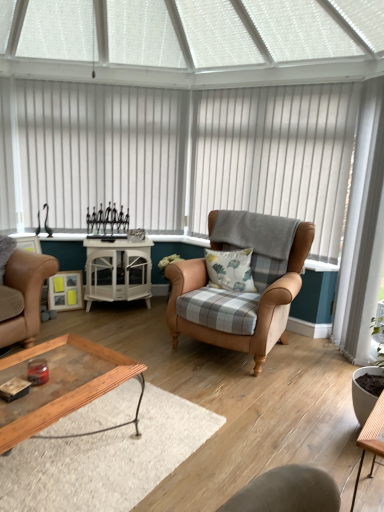
At what (x,y) coordinates should I click in order to perform the action: click on empty space that is ontop of wooden tray at lower center (from a real-world perspective). Please return your answer as a coordinate pair (x, y). The width and height of the screenshot is (384, 512). Looking at the image, I should click on (53, 373).